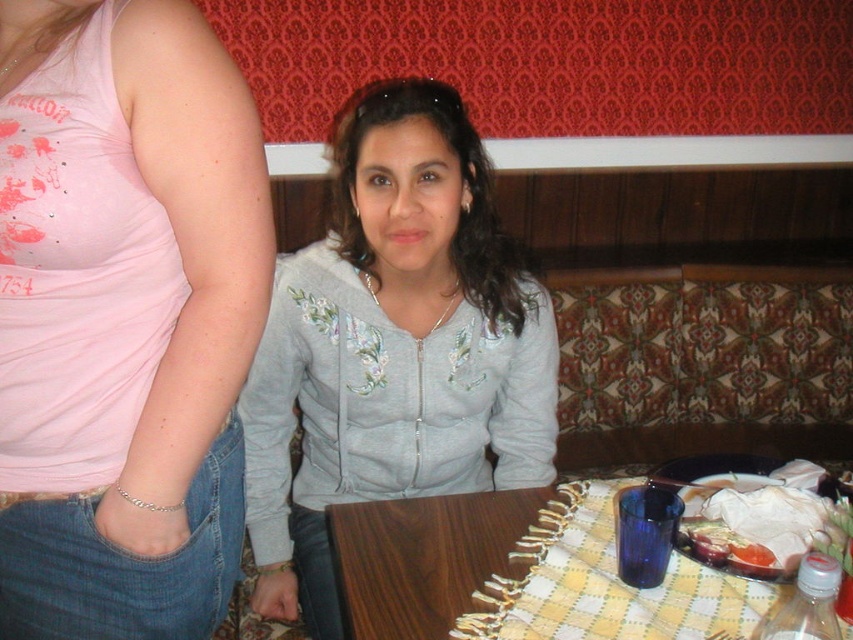
Question: Can you confirm if gray fleece jacket at center is thinner than translucent plastic cup at table right?

Choices:
 (A) yes
 (B) no

Answer: (B)

Question: Which point appears farthest from the camera in this image?

Choices:
 (A) (799, 550)
 (B) (534, 321)

Answer: (B)

Question: Can you confirm if matte gray hoodie at center is thinner than gray fleece jacket at center?

Choices:
 (A) no
 (B) yes

Answer: (B)

Question: Can you confirm if wooden table at lower center is positioned to the right of translucent plastic cup at table right?

Choices:
 (A) yes
 (B) no

Answer: (B)

Question: Which point is closer to the camera?

Choices:
 (A) (289, 358)
 (B) (86, 64)
 (C) (795, 570)

Answer: (B)

Question: Which point is farther from the camera taking this photo?

Choices:
 (A) (434, 100)
 (B) (750, 548)

Answer: (A)